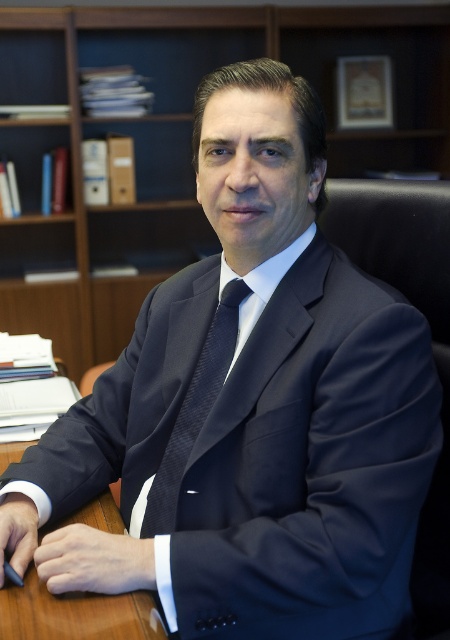
You are a delivery person standing at the entrance of the office. You need to place a package on the desk between the wooden bookshelf at upper center and the navy blue textured tie at center. The package requires 1.5 meters of space. Is there enough space between them?

The distance between the wooden bookshelf at upper center and the navy blue textured tie at center is 2.31 meters, which is more than the required 1.5 meters. Therefore, there is enough space to place the package between them.

You are an interior designer planning to hang a painting that is 0.2 meters wide on the wall. The wooden bookshelf at upper center is located at coordinates 0.222, 0.398. If the recommended distance between the painting and the bookshelf is 0.1 meters, where should you place the painting?

The wooden bookshelf at upper center is located at coordinates (x=179, y=141). To maintain the recommended distance of 0.1 meters, the painting should be placed either 0.1 meters to the left, right, above, or below the bookshelf, ensuring it does not overlap and adheres to the spacing guideline.